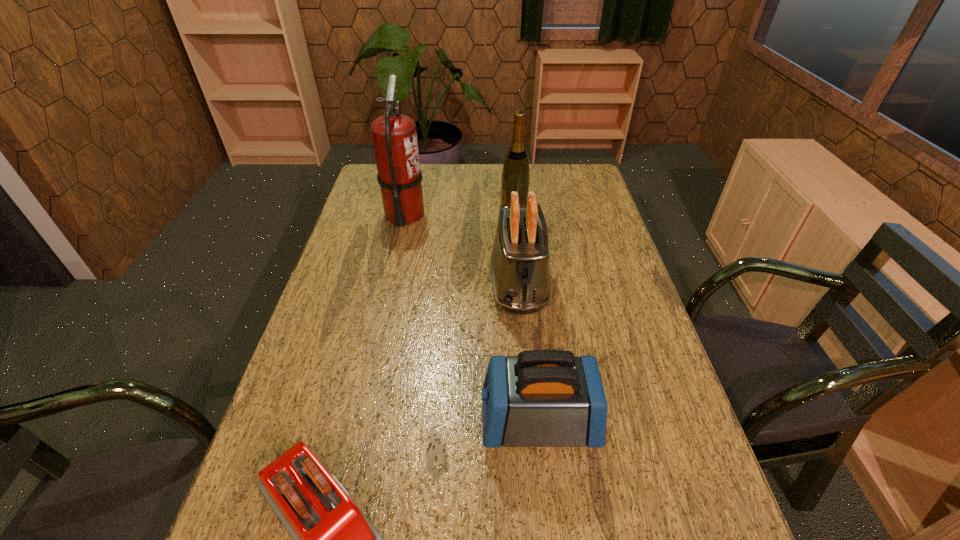
Locate an element on the screen. This screenshot has height=540, width=960. fire extinguisher is located at coordinates (394, 135).

Identify the location of the fourth shortest object. This screenshot has height=540, width=960. [515, 175].

Find the location of a particular element. the tallest toaster is located at coordinates (519, 270).

Where is `the farthest toaster`? The width and height of the screenshot is (960, 540). the farthest toaster is located at coordinates (519, 270).

This screenshot has height=540, width=960. I want to click on the fourth tallest object, so click(x=541, y=398).

The width and height of the screenshot is (960, 540). Identify the location of free space located toward the nozzle of the tallest object. (460, 215).

Identify the location of free space located on the front-facing side of the fourth shortest object. The width and height of the screenshot is (960, 540). (458, 208).

This screenshot has width=960, height=540. What are the coordinates of `free space located 0.100m on the front-facing side of the fourth shortest object` in the screenshot? It's located at (472, 208).

Locate an element on the screen. This screenshot has width=960, height=540. free space located 0.260m on the front-facing side of the fourth shortest object is located at coordinates (427, 208).

The image size is (960, 540). In order to click on vacant space located 0.110m on the side of the farthest toaster with the control lever in this screenshot , I will do `click(526, 357)`.